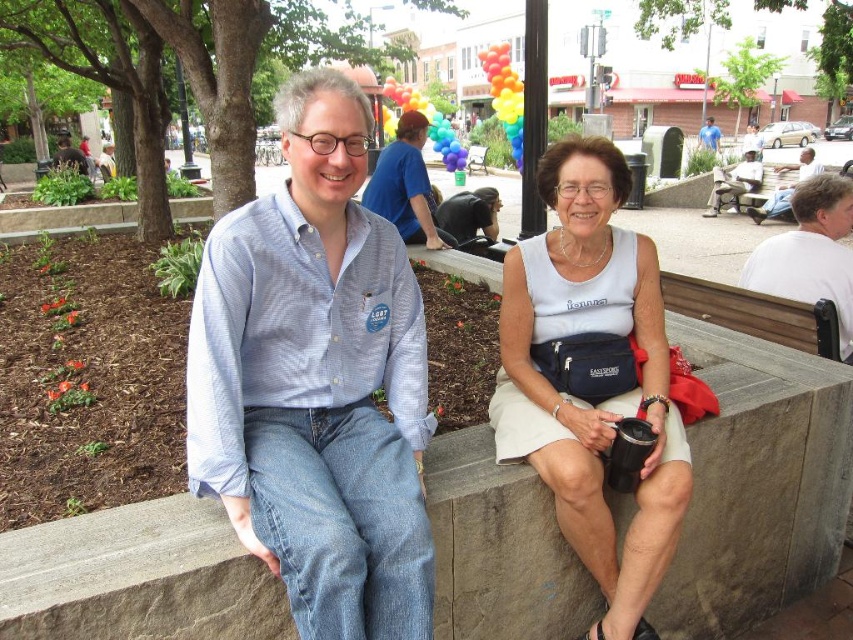
You are organizing a small event in the park and need to decide seating arrangements. You have a white fabric tank top at center and a wooden bench at center. Which object can accommodate more people for seating?

The wooden bench at center can accommodate more people for seating since it is larger in size compared to the white fabric tank top at center.

You are a photographer standing in the park and see the white fabric tank top at center and a camera. How far apart are they?

The white fabric tank top at center and the camera are 1.92 meters apart.

You are standing in the park and want to locate the white fabric tank top at center. According to the coordinates provided, where would you find it?

The white fabric tank top at center is located at the coordinates point [585,400].